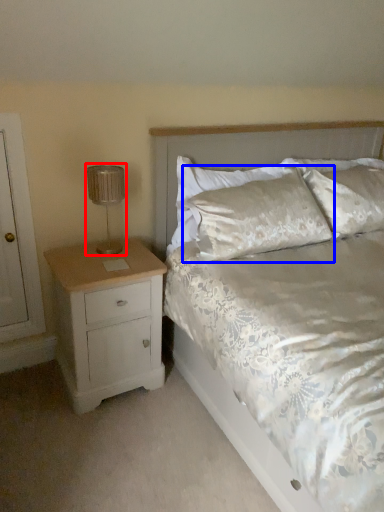
Question: Which object appears closest to the camera in this image, lamp (highlighted by a red box) or pillow (highlighted by a blue box)?

Choices:
 (A) lamp
 (B) pillow

Answer: (A)